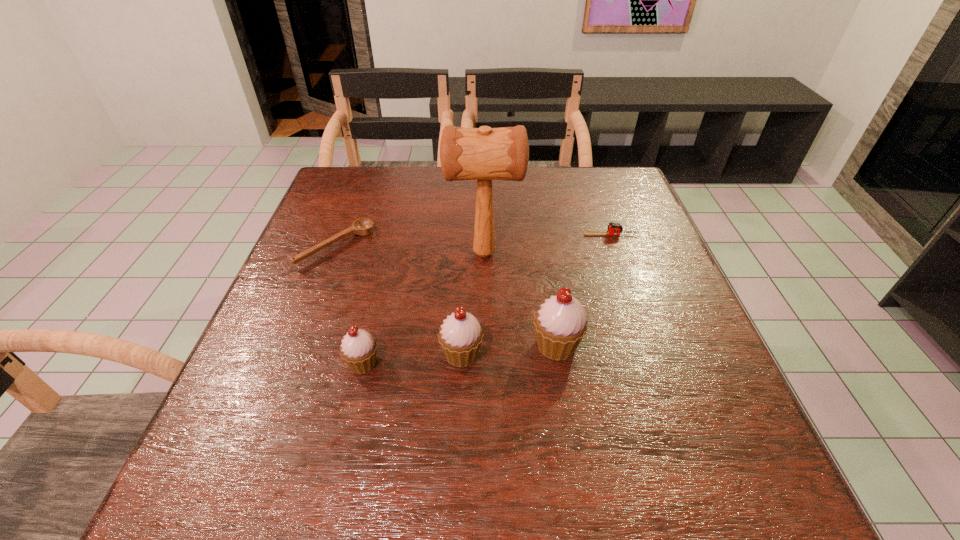
You are a GUI agent. You are given a task and a screenshot of the screen. Output one action in this format:
    pyautogui.click(x=<x>, y=<y>)
    Task: Click on the free space at the near edge of the desktop
    Image resolution: width=960 pixels, height=540 pixels.
    Given the screenshot: What is the action you would take?
    pyautogui.click(x=322, y=417)

In order to click on vacant area at the left edge in this screenshot , I will do `click(348, 267)`.

At what (x,y) coordinates should I click in order to perform the action: click on free space at the right edge of the desktop. Please return your answer as a coordinate pair (x, y). Looking at the image, I should click on (669, 295).

Where is `free space at the far left corner`? The image size is (960, 540). free space at the far left corner is located at coordinates (370, 181).

Identify the location of vacant region at the near left corner of the desktop. (251, 392).

Locate an element on the screen. The image size is (960, 540). blank space at the far right corner of the desktop is located at coordinates (595, 194).

The width and height of the screenshot is (960, 540). In the image, there is a desktop. In order to click on free region at the near right corner in this screenshot , I will do `click(718, 435)`.

You are a GUI agent. You are given a task and a screenshot of the screen. Output one action in this format:
    pyautogui.click(x=<x>, y=<y>)
    Task: Click on the free space between the fifth shortest object and the tape measure
    This screenshot has height=540, width=960.
    Given the screenshot: What is the action you would take?
    pyautogui.click(x=584, y=290)

This screenshot has width=960, height=540. I want to click on free space between the second tallest object and the rightmost object, so click(x=584, y=290).

Find the location of `empty space between the second cupcake from right to left and the tallest cupcake`. empty space between the second cupcake from right to left and the tallest cupcake is located at coordinates (509, 350).